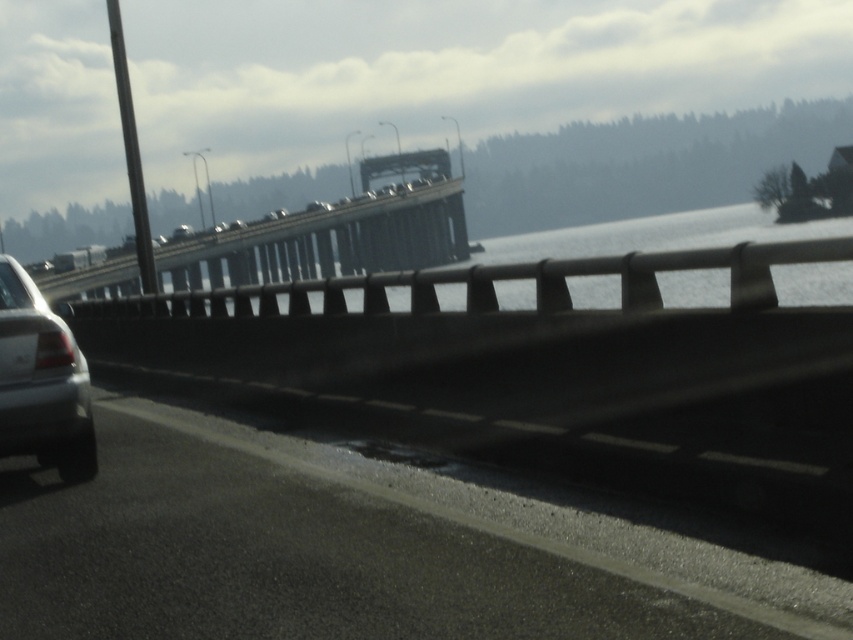
Question: Which of the following is the closest to the observer?

Choices:
 (A) metallic gray bridge at upper center
 (B) satin silver sedan at left

Answer: (B)

Question: Does metallic gray bridge at upper center lie behind satin silver sedan at left?

Choices:
 (A) yes
 (B) no

Answer: (A)

Question: Does metallic gray bridge at upper center appear over satin silver sedan at left?

Choices:
 (A) yes
 (B) no

Answer: (A)

Question: Which point appears closest to the camera in this image?

Choices:
 (A) (21, 435)
 (B) (171, 280)

Answer: (A)

Question: Does metallic gray bridge at upper center appear under satin silver sedan at left?

Choices:
 (A) no
 (B) yes

Answer: (A)